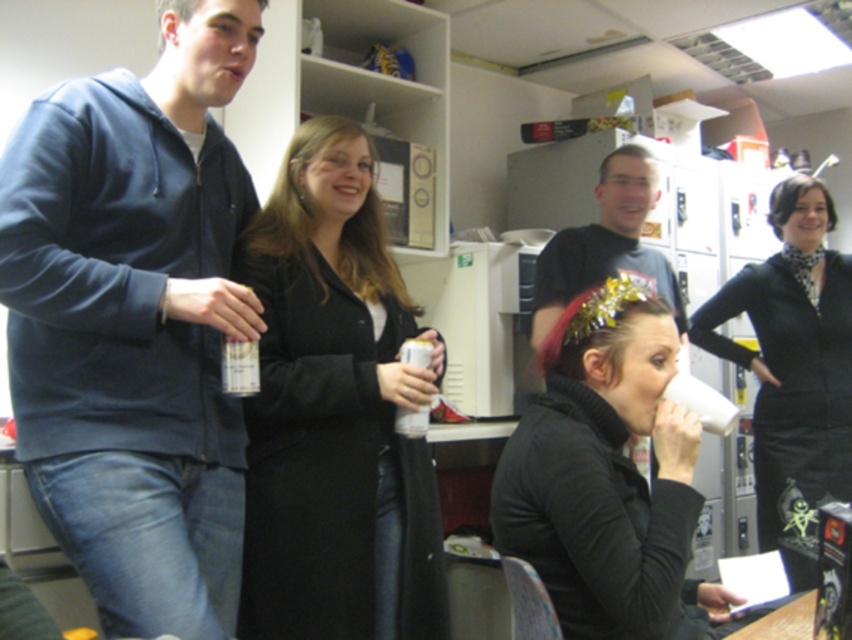
Can you confirm if matte blue hoodie at left is thinner than matte black turtleneck at center?

Yes.

Does matte blue hoodie at left have a lesser height compared to matte black turtleneck at center?

No.

At what (x,y) coordinates should I click in order to perform the action: click on matte blue hoodie at left. Please return your answer as a coordinate pair (x, y). Looking at the image, I should click on (135, 323).

Can you confirm if matte blue hoodie at left is taller than matte black coat at center?

Indeed, matte blue hoodie at left has a greater height compared to matte black coat at center.

Is the position of matte blue hoodie at left more distant than that of matte black coat at center?

No, it is not.

Between point (171, 372) and point (361, 468), which one is positioned behind?

The point (361, 468) is more distant.

Locate an element on the screen. The image size is (852, 640). matte blue hoodie at left is located at coordinates (135, 323).

Which is below, matte blue hoodie at left or black matte dress at right?

black matte dress at right is lower down.

Is the position of matte blue hoodie at left more distant than that of black matte dress at right?

That is False.

Identify the location of matte blue hoodie at left. (135, 323).

The image size is (852, 640). I want to click on matte blue hoodie at left, so click(x=135, y=323).